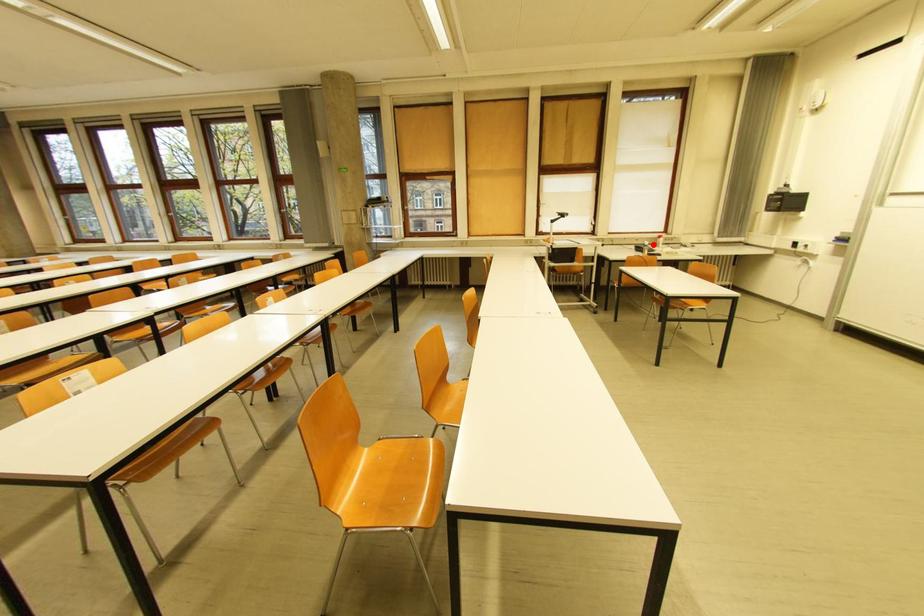
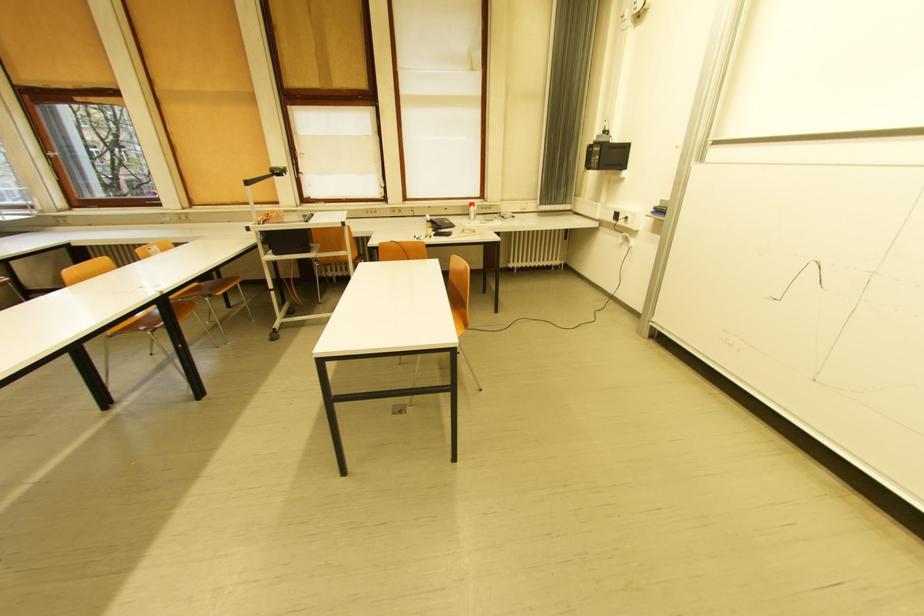
The point at the highlighted location is marked in the first image. Where is the corresponding point in the second image?

(434, 219)